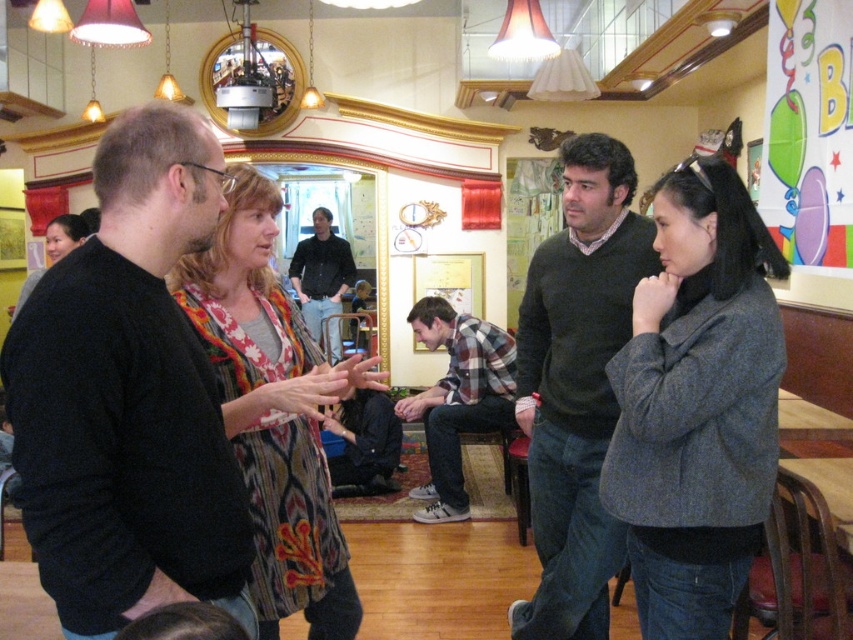
You are a fashion designer observing the image and want to create a new outfit that combines both the dark gray sweater at center and the dark blue jeans at center. Which item should you choose as the main focus of the outfit and why?

The dark gray sweater at center should be the main focus because it is bigger than the dark blue jeans at center, making it a more prominent element in the outfit.

You are a photographer trying to capture a candid shot of the dark gray sweater at center and the dark blue jeans at center. Since you want to focus on the sweater, should you adjust your camera to focus on the foreground or background?

The dark gray sweater at center is in front of the dark blue jeans at center, so to focus on the sweater, you should adjust the camera to focus on the foreground.

You are a tailor who needs to know the size relationship between the gray woolen jacket at right and the dark gray sweater at center. Which one is larger?

The dark gray sweater at center is larger than the gray woolen jacket at right.